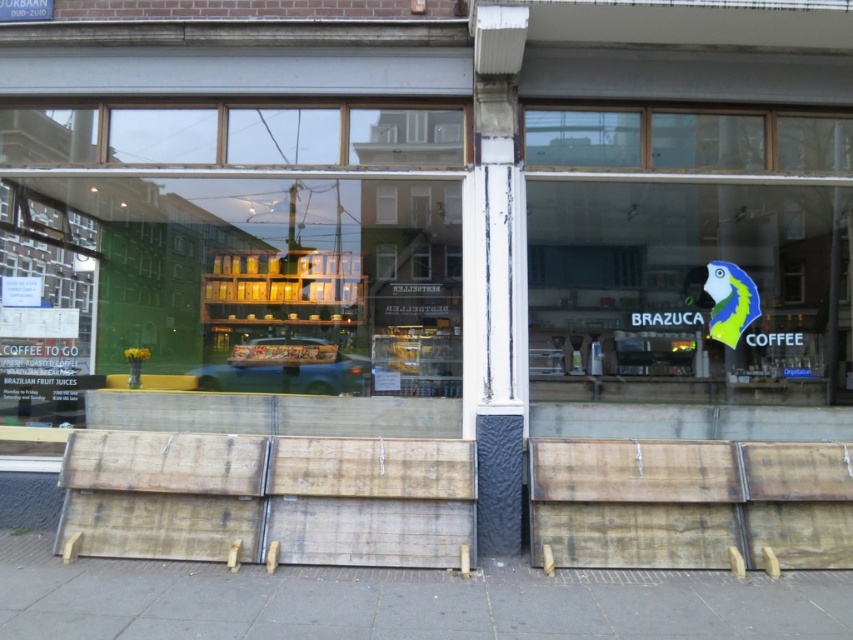
You are a delivery person standing outside the BRAZUCA COFFEE shop. You need to place a large box that is 3 meters long. Can you fit the box horizontally between the transparent glass shop window at center and the transparent glass window at upper center?

The distance between the transparent glass shop window at center and the transparent glass window at upper center is 2.86 meters. Since the box is 3 meters long, it cannot fit horizontally between them as the space is shorter than the box.

You are a delivery person trying to deliver a package to the BRAZUCA COFFEE shop. You see the transparent glass shop window at center and the metallic silver car at center. Which object is smaller in size?

The transparent glass shop window at center is smaller in size compared to the metallic silver car at center.

You are standing outside the BRAZUCA COFFEE shop. There is a point marked at coordinates [231,304] on the shop window. Is this point located on the transparent glass shop window at center?

Yes, the transparent glass shop window at center is represented by point [231,304], so the point is located on the transparent glass shop window at center.